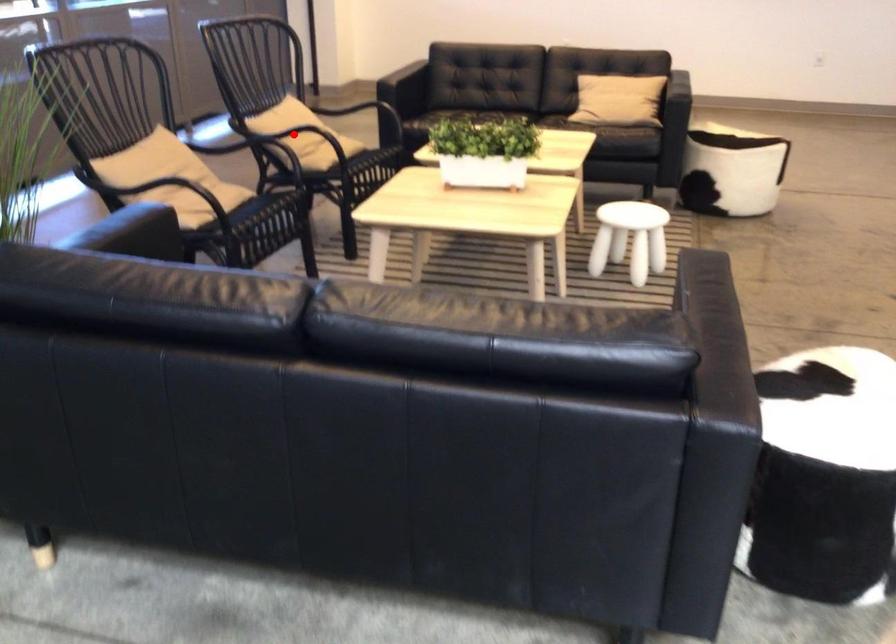
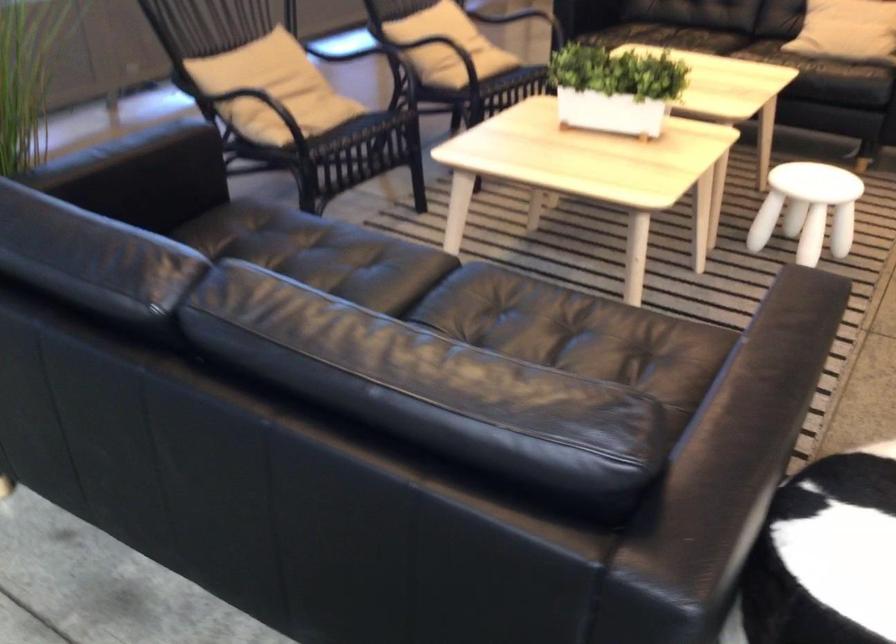
Question: I am providing you with two images of the same scene from different viewpoints. A red point is marked on the first image. Is the red point's position out of view in image 2?

Choices:
 (A) Yes
 (B) No

Answer: (B)